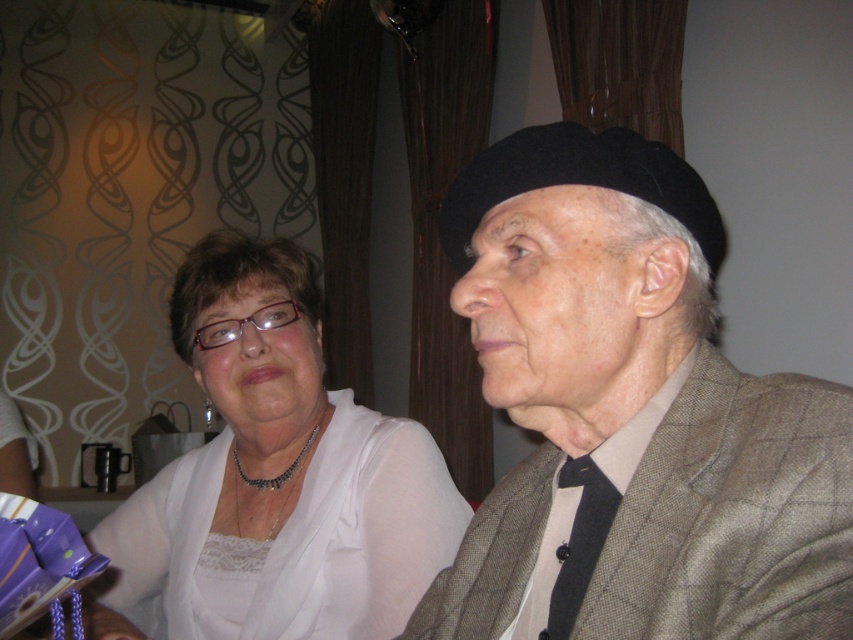
Question: Is matte black beret at upper right bigger than white satin blouse at center?

Choices:
 (A) no
 (B) yes

Answer: (A)

Question: Which point appears farthest from the camera in this image?

Choices:
 (A) (838, 624)
 (B) (390, 636)

Answer: (B)

Question: Is matte black beret at upper right behind white satin blouse at center?

Choices:
 (A) yes
 (B) no

Answer: (B)

Question: Which object is positioned closest to the white satin blouse at center?

Choices:
 (A) black textured tie at center
 (B) matte black beret at upper right

Answer: (B)

Question: Is matte black beret at upper right smaller than white satin blouse at center?

Choices:
 (A) yes
 (B) no

Answer: (A)

Question: Which point is farther to the camera?

Choices:
 (A) matte black beret at upper right
 (B) white satin blouse at center

Answer: (B)